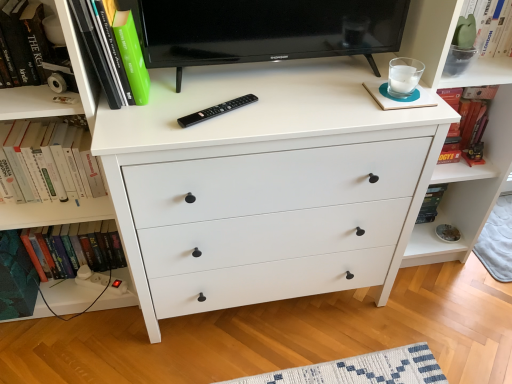
At what (x,y) coordinates should I click in order to perform the action: click on free space in front of black glossy tv at upper center. Please return your answer as a coordinate pair (x, y). The height and width of the screenshot is (384, 512). Looking at the image, I should click on (272, 110).